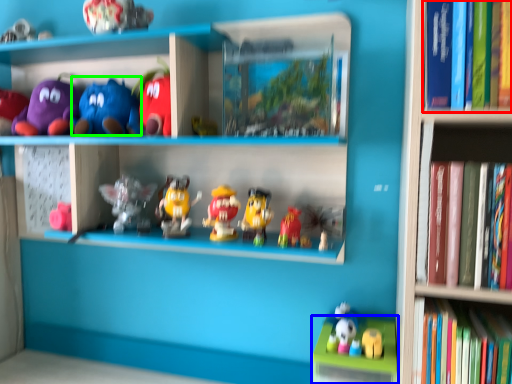
Question: Which object is the closest to the book (highlighted by a red box)? Choose among these: cabinet (highlighted by a blue box) or toy (highlighted by a green box).

Choices:
 (A) cabinet
 (B) toy

Answer: (A)